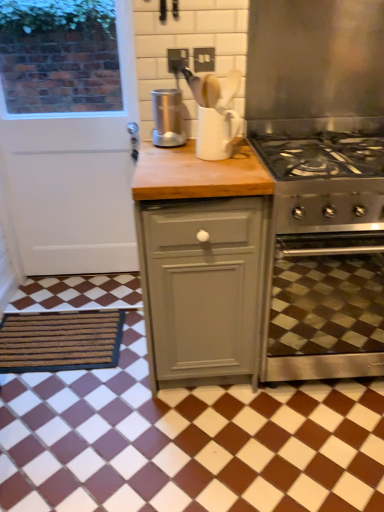
Question: Considering the relative positions of brown textured mat at lower left and stainless steel exhaust hood at upper right in the image provided, is brown textured mat at lower left to the left or to the right of stainless steel exhaust hood at upper right?

Choices:
 (A) right
 (B) left

Answer: (B)

Question: Is brown textured mat at lower left bigger or smaller than stainless steel exhaust hood at upper right?

Choices:
 (A) big
 (B) small

Answer: (B)

Question: Which of these objects is positioned closest to the brown textured mat at lower left?

Choices:
 (A) matte gray cabinet at center
 (B) white glossy mug at upper center
 (C) stainless steel exhaust hood at upper right
 (D) white matte door at left
 (E) stainless steel oven at right

Answer: (D)

Question: Considering the real-world distances, which object is closest to the matte gray cabinet at center?

Choices:
 (A) white glossy mug at upper center
 (B) stainless steel exhaust hood at upper right
 (C) white matte door at left
 (D) brushed metal canister at upper center
 (E) stainless steel oven at right

Answer: (E)